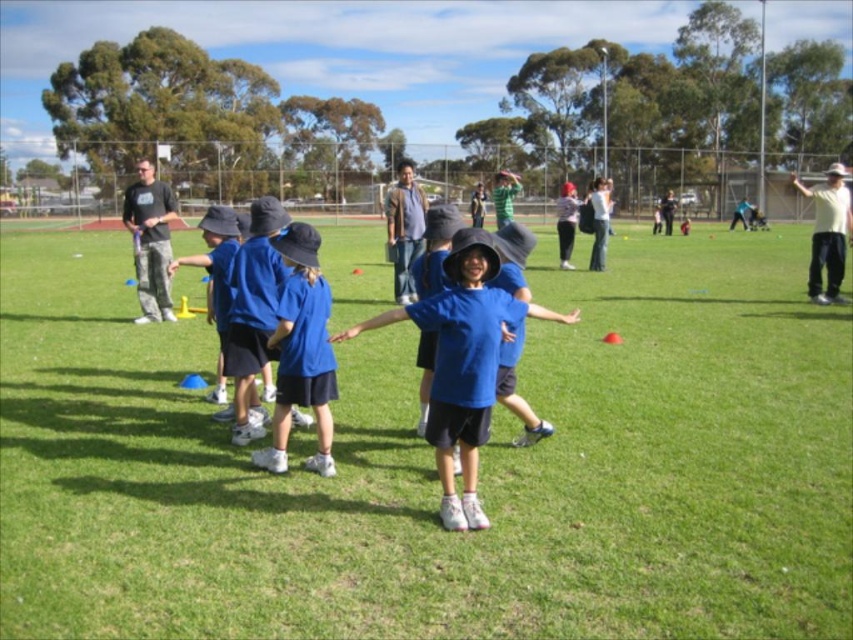
Question: From the image, what is the correct spatial relationship of blue fabric shirt at center in relation to blue matte hat at center?

Choices:
 (A) right
 (B) left

Answer: (A)

Question: Which point is closer to the camera?

Choices:
 (A) (473, 429)
 (B) (102, 257)

Answer: (A)

Question: Which object appears farthest from the camera in this image?

Choices:
 (A) blue fabric shirt at center
 (B) blue matte hat at center

Answer: (B)

Question: Can you confirm if blue fabric shirt at center is positioned below blue matte hat at center?

Choices:
 (A) no
 (B) yes

Answer: (A)

Question: Among these objects, which one is farthest from the camera?

Choices:
 (A) blue fabric shirt at center
 (B) blue matte shirt at center
 (C) blue matte hat at center

Answer: (C)

Question: Does blue matte shirt at center lie behind blue matte hat at center?

Choices:
 (A) no
 (B) yes

Answer: (A)